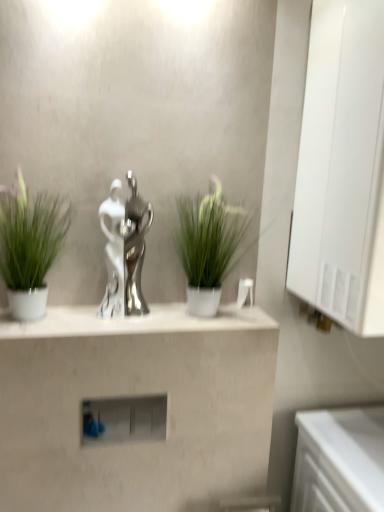
What are the coordinates of `vacant area situated below green matte plant at center, the first houseplant when ordered from right to left (from a real-world perspective)` in the screenshot? It's located at (216, 314).